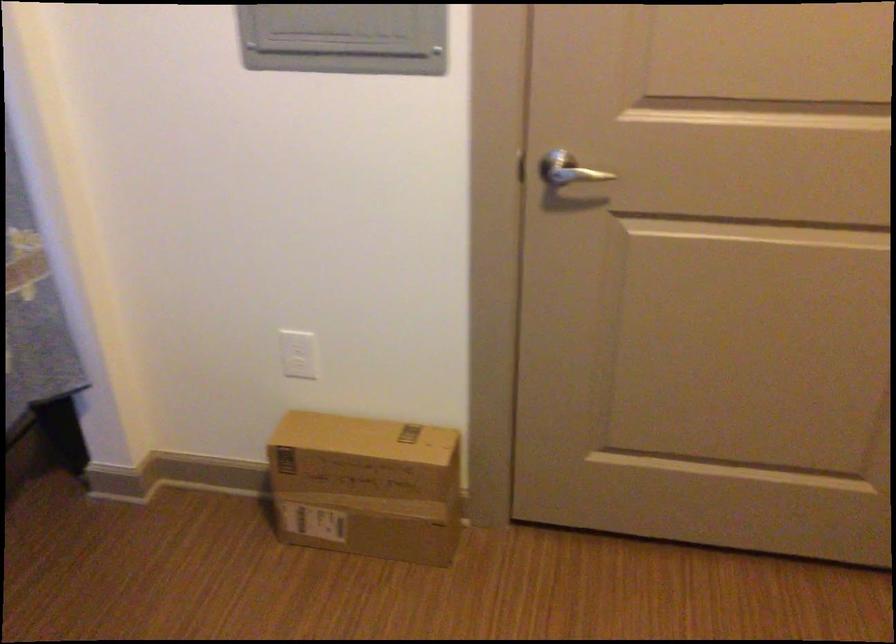
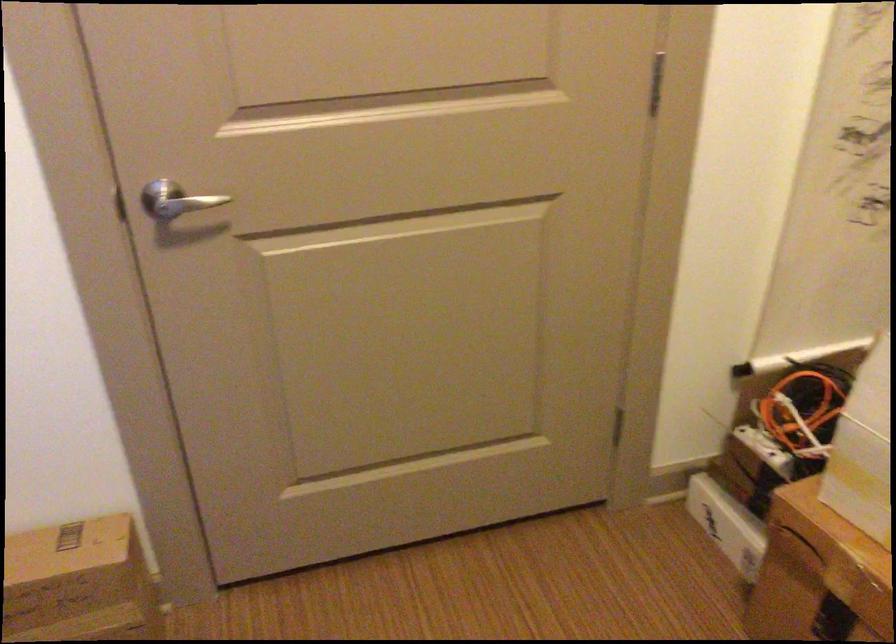
Question: The camera is either moving clockwise (left) or counter-clockwise (right) around the object. The first image is from the beginning of the video and the second image is from the end. Is the camera moving left or right when shooting the video?

Choices:
 (A) Left
 (B) Right

Answer: (A)